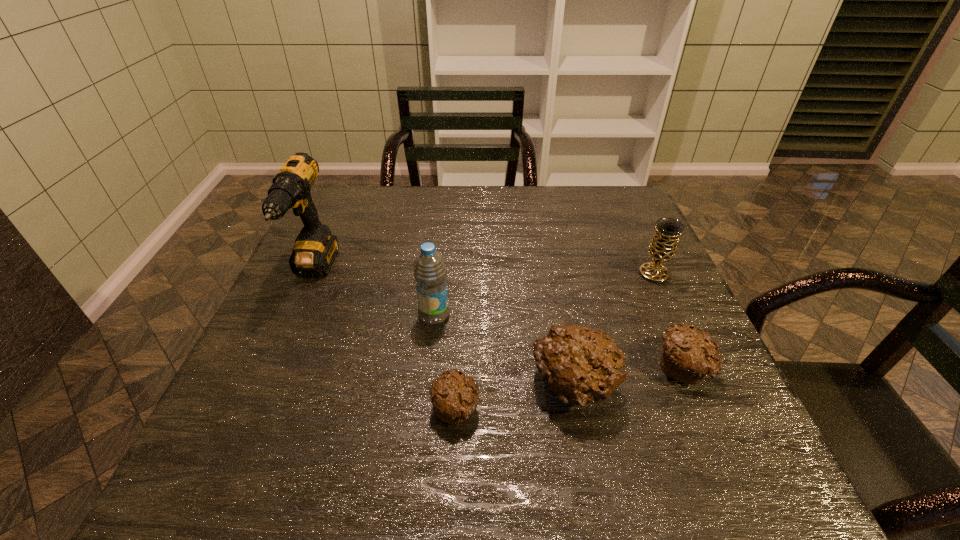
The height and width of the screenshot is (540, 960). What are the coordinates of `chalice` in the screenshot? It's located at (662, 248).

Find the location of `free location located 0.150m on the back of the leftmost muffin`. free location located 0.150m on the back of the leftmost muffin is located at coordinates (460, 327).

You are a GUI agent. You are given a task and a screenshot of the screen. Output one action in this format:
    pyautogui.click(x=<x>, y=<y>)
    Task: Click on the free space located 0.050m on the left of the fourth tallest object
    
    Given the screenshot: What is the action you would take?
    pyautogui.click(x=506, y=386)

Where is `blank space located on the left of the second tallest muffin`? blank space located on the left of the second tallest muffin is located at coordinates (472, 367).

Identify the location of vacant space located on the front of the fourth nearest object. The width and height of the screenshot is (960, 540). (430, 356).

Identify the location of vacant space located 0.070m at the tip of the leftmost object. (290, 327).

Where is `free point located 0.280m on the left of the chalice`? This screenshot has height=540, width=960. free point located 0.280m on the left of the chalice is located at coordinates (528, 274).

Where is `object that is positioned at the left edge`? This screenshot has height=540, width=960. object that is positioned at the left edge is located at coordinates (315, 248).

This screenshot has width=960, height=540. In order to click on muffin that is at the right edge in this screenshot , I will do `click(688, 355)`.

This screenshot has height=540, width=960. Find the location of `chalice located in the right edge section of the desktop`. chalice located in the right edge section of the desktop is located at coordinates (662, 248).